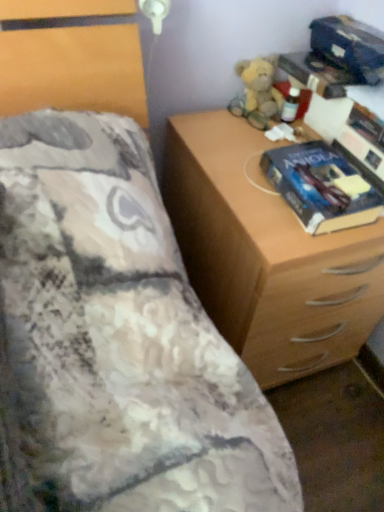
Question: Is fluffy beige teddy bear at upper right touching blue glossy paperback book at right?

Choices:
 (A) yes
 (B) no

Answer: (B)

Question: Does fluffy beige teddy bear at upper right have a smaller size compared to blue glossy paperback book at right?

Choices:
 (A) no
 (B) yes

Answer: (B)

Question: Can you confirm if fluffy beige teddy bear at upper right is positioned to the left of blue glossy paperback book at right?

Choices:
 (A) no
 (B) yes

Answer: (B)

Question: Is fluffy beige teddy bear at upper right in front of blue glossy paperback book at right?

Choices:
 (A) no
 (B) yes

Answer: (A)

Question: From a real-world perspective, is fluffy beige teddy bear at upper right below blue glossy paperback book at right?

Choices:
 (A) no
 (B) yes

Answer: (A)

Question: From a real-world perspective, does fluffy beige teddy bear at upper right stand above blue glossy paperback book at right?

Choices:
 (A) no
 (B) yes

Answer: (B)

Question: Could fluffy beige teddy bear at upper right be considered to be inside wooden chest of drawers at right?

Choices:
 (A) no
 (B) yes

Answer: (A)

Question: Is wooden chest of drawers at right next to fluffy beige teddy bear at upper right and touching it?

Choices:
 (A) no
 (B) yes

Answer: (A)

Question: From the image's perspective, does wooden chest of drawers at right appear lower than fluffy beige teddy bear at upper right?

Choices:
 (A) no
 (B) yes

Answer: (B)

Question: Is wooden chest of drawers at right looking in the opposite direction of fluffy beige teddy bear at upper right?

Choices:
 (A) no
 (B) yes

Answer: (A)

Question: Can you confirm if wooden chest of drawers at right is positioned to the left of fluffy beige teddy bear at upper right?

Choices:
 (A) yes
 (B) no

Answer: (B)

Question: Can you confirm if wooden chest of drawers at right is shorter than fluffy beige teddy bear at upper right?

Choices:
 (A) no
 (B) yes

Answer: (A)

Question: From a real-world perspective, is wooden chest of drawers at right on blue glossy paperback book at right?

Choices:
 (A) yes
 (B) no

Answer: (B)